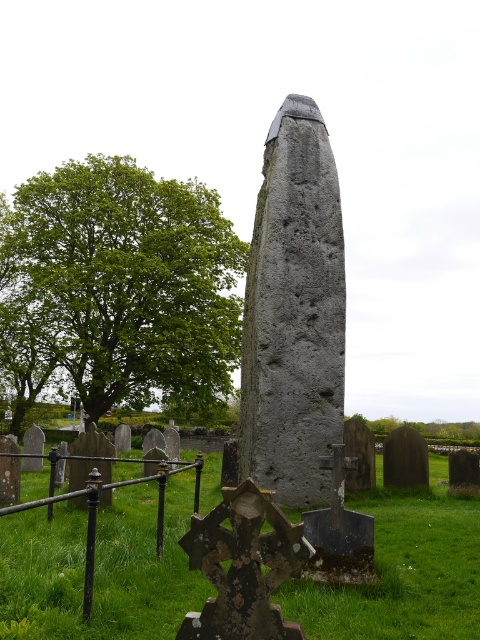
Based on the photo, you are standing at the entrance of the cemetery and want to take a photo of the green grass at center and the green leafy tree at upper left. From your current position, which object will appear closer to you in the photo?

The green grass at center will appear closer to you in the photo because it is in front of the green leafy tree at upper left.

You are a gardener who needs to mow the lawn. Based on the scene, which area would require less time to mow, the green grass at center or the green leafy tree at upper left?

The green grass at center is shorter than the green leafy tree at upper left, so it would require less time to mow the green grass at center.